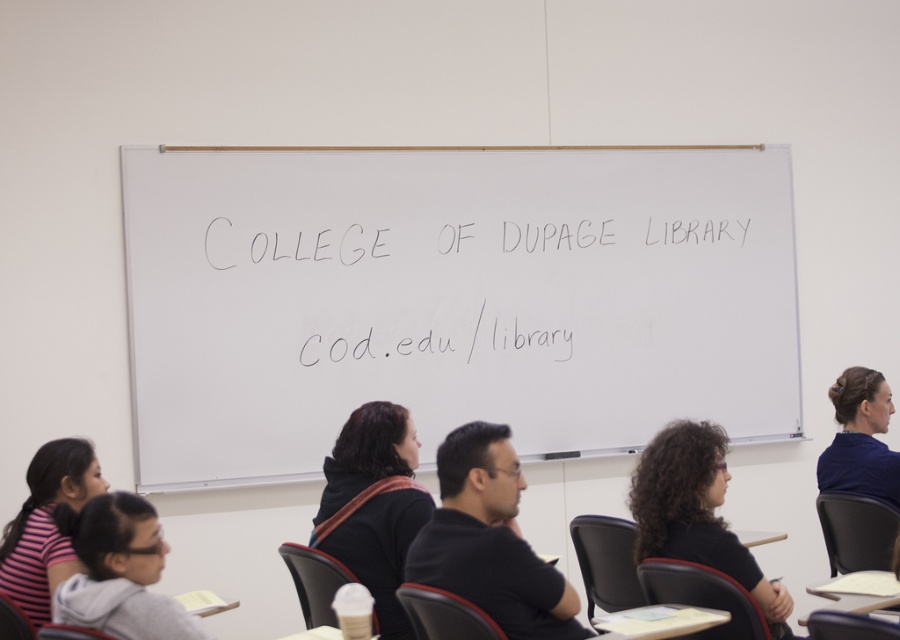
You are a student sitting in the classroom and want to read the white chalk writing at center and the black matte shirt at center. Which object is wider?

The white chalk writing at center is wider than the black matte shirt at center.